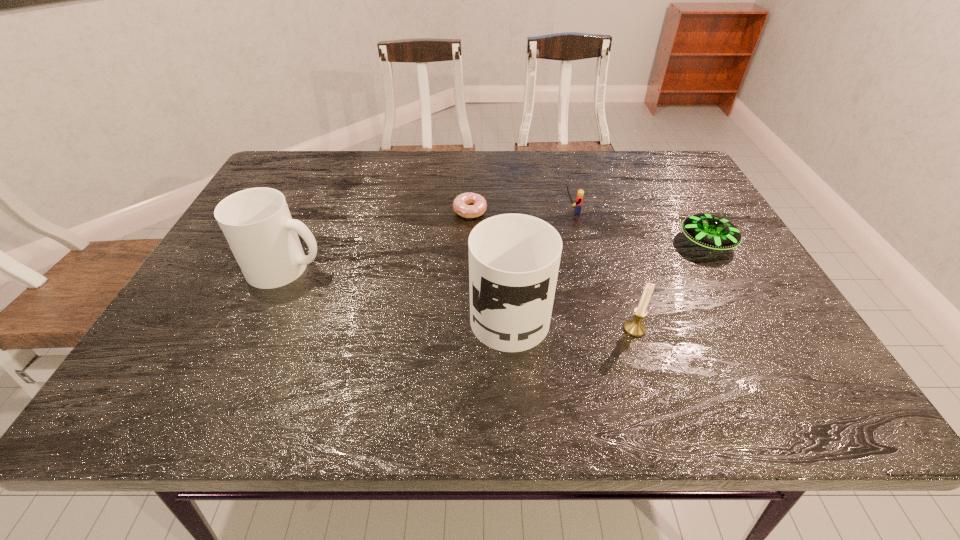
What are the coordinates of `vacant point located 0.350m on the left of the candle holder` in the screenshot? It's located at [x=454, y=329].

Identify the location of mug that is at the near edge. Image resolution: width=960 pixels, height=540 pixels. (514, 259).

Image resolution: width=960 pixels, height=540 pixels. What are the coordinates of `candle holder at the near edge` in the screenshot? It's located at (635, 327).

Locate an element on the screen. The width and height of the screenshot is (960, 540). object present at the left edge is located at coordinates (257, 224).

Where is `object that is at the right edge`? The image size is (960, 540). object that is at the right edge is located at coordinates (709, 231).

Locate an element on the screen. free space at the far edge of the desktop is located at coordinates (627, 187).

You are a GUI agent. You are given a task and a screenshot of the screen. Output one action in this format:
    pyautogui.click(x=<x>, y=<y>)
    Task: Click on the free space at the near edge of the desktop
    
    Given the screenshot: What is the action you would take?
    pyautogui.click(x=694, y=344)

At what (x,y) coordinates should I click in order to perform the action: click on free space at the left edge of the desktop. Please return your answer as a coordinate pair (x, y). The width and height of the screenshot is (960, 540). Looking at the image, I should click on (238, 294).

Find the location of a particular element. This screenshot has height=540, width=960. blank space at the right edge is located at coordinates (750, 263).

You are a GUI agent. You are given a task and a screenshot of the screen. Output one action in this format:
    pyautogui.click(x=<x>, y=<y>)
    Task: Click on the vacant space at the far right corner of the desktop
    
    Given the screenshot: What is the action you would take?
    pyautogui.click(x=676, y=177)